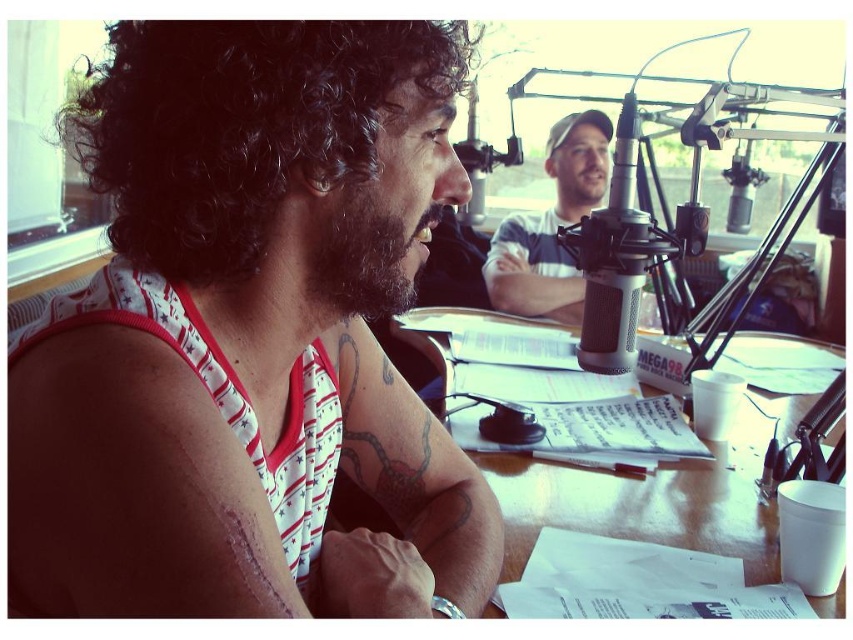
Is dark curly hair at upper left taller than white striped shirt at center?

No.

Is dark curly hair at upper left above white striped shirt at center?

Incorrect, dark curly hair at upper left is not positioned above white striped shirt at center.

Is point (376, 108) more distant than point (509, 259)?

No, (376, 108) is closer to viewer.

Where is `dark curly hair at upper left`? This screenshot has width=853, height=640. dark curly hair at upper left is located at coordinates (239, 122).

Who is lower down, scar tissue at upper left or white striped shirt at center?

scar tissue at upper left

Is scar tissue at upper left wider than white striped shirt at center?

In fact, scar tissue at upper left might be narrower than white striped shirt at center.

Measure the distance between point [90,429] and camera.

17.14 inches

Find the location of a particular element. The image size is (853, 640). scar tissue at upper left is located at coordinates (132, 490).

Does white striped tank top at left have a greater height compared to white striped shirt at center?

No.

Who is more distant from viewer, [196,362] or [509,289]?

Point [509,289]

Where is `white striped tank top at left`? This screenshot has height=640, width=853. white striped tank top at left is located at coordinates (248, 337).